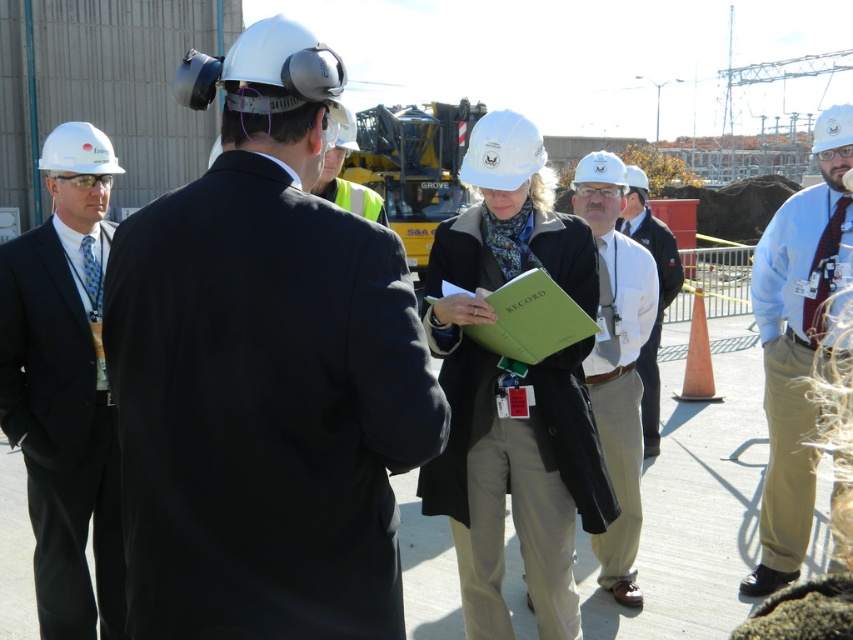
Which of these two, yellow reflective vest at center or white matte hard hat at center, stands taller?

white matte hard hat at center

Which is in front, point (323, 157) or point (583, 157)?

Point (323, 157)

The image size is (853, 640). I want to click on yellow reflective vest at center, so pyautogui.click(x=345, y=179).

You are a GUI agent. You are given a task and a screenshot of the screen. Output one action in this format:
    pyautogui.click(x=<x>, y=<y>)
    Task: Click on the yellow reflective vest at center
    This screenshot has width=853, height=640.
    Given the screenshot: What is the action you would take?
    pyautogui.click(x=345, y=179)

The height and width of the screenshot is (640, 853). I want to click on light blue shirt with tie at center, so click(798, 342).

What do you see at coordinates (798, 342) in the screenshot? The height and width of the screenshot is (640, 853). I see `light blue shirt with tie at center` at bounding box center [798, 342].

Identify the location of light blue shirt with tie at center. The image size is (853, 640). (798, 342).

Is light blue shirt with tie at center further to camera compared to white matte hard hat at center?

That is False.

Is point (769, 433) behind point (579, 180)?

Yes, point (769, 433) is farther from viewer.

At what (x,y) coordinates should I click in order to perform the action: click on light blue shirt with tie at center. Please return your answer as a coordinate pair (x, y). This screenshot has width=853, height=640. Looking at the image, I should click on (798, 342).

Locate an element on the screen. The height and width of the screenshot is (640, 853). light blue shirt with tie at center is located at coordinates point(798,342).